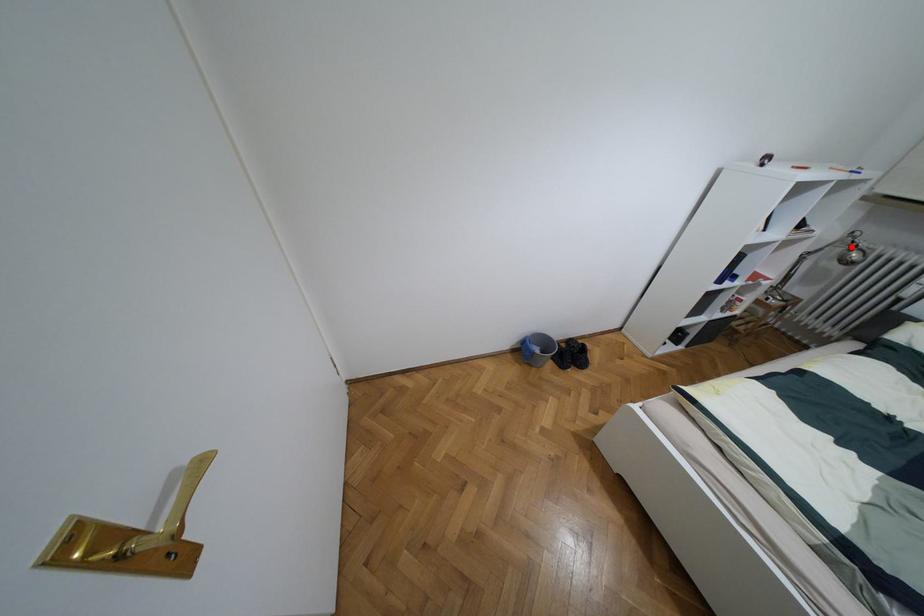
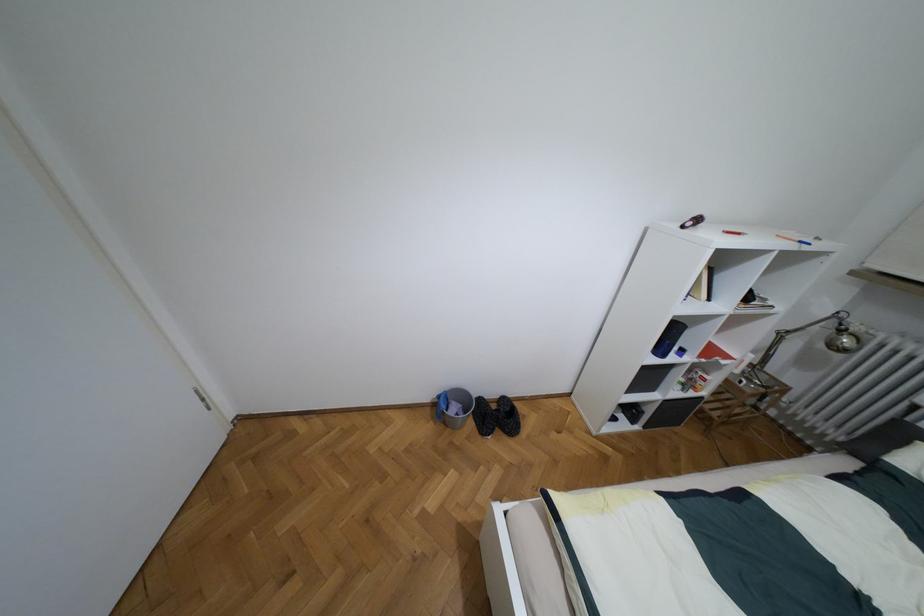
Question: I am providing you with two images of the same scene from different viewpoints. A red point is shown in image1. For the corresponding object point in image2, is it positioned nearer or farther from the camera?

Choices:
 (A) Nearer
 (B) Farther

Answer: (A)